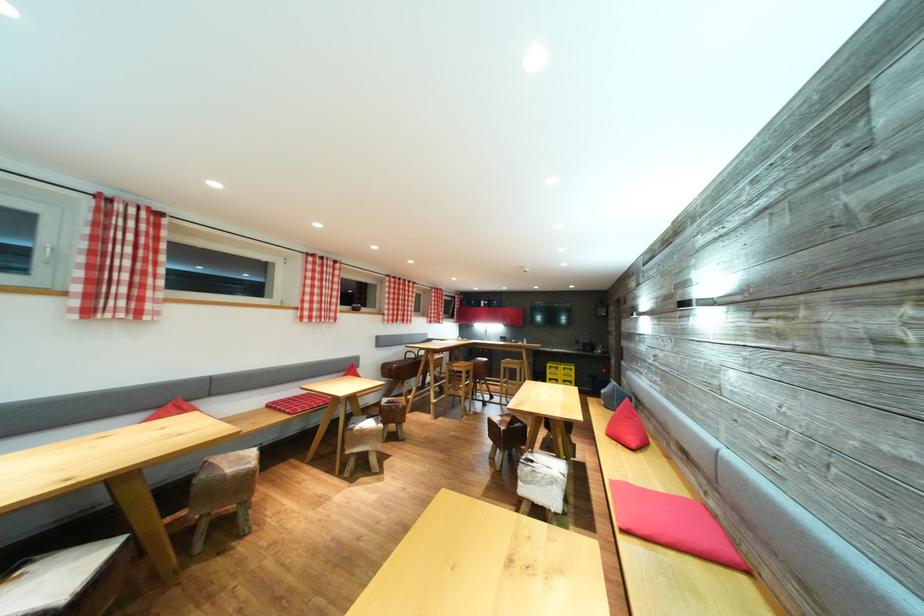
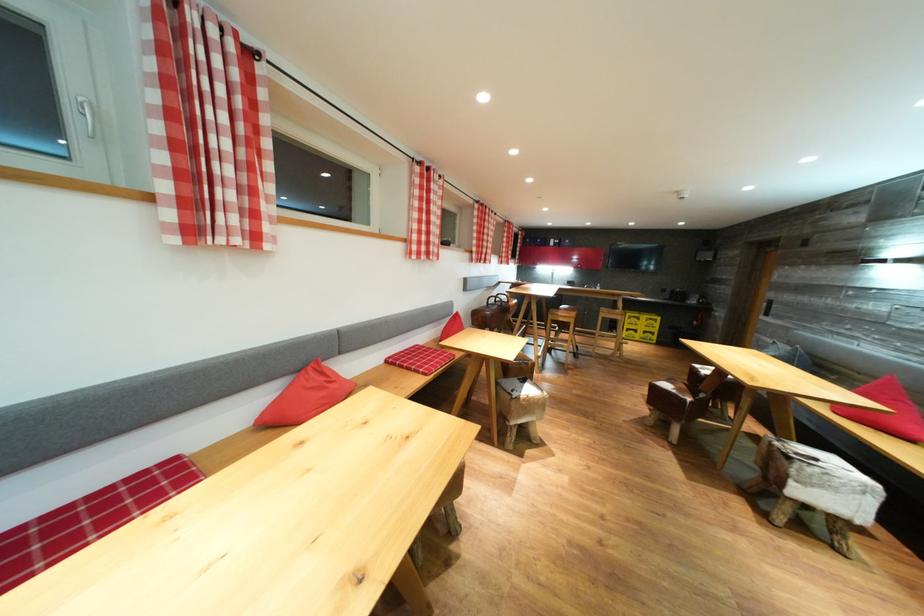
Find the pixel in the second image that matches the point at 463,374 in the first image.

(567, 325)